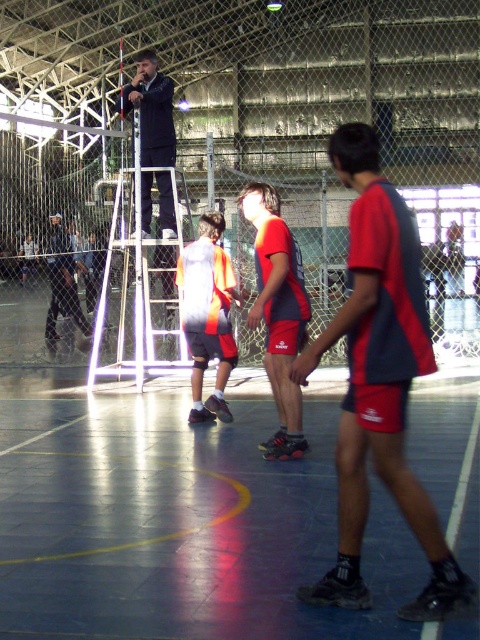
You are a referee standing at the edge of the basketball court. You need to determine if the distance between the orange mesh shorts at center and the dark blue jacket at upper center is more than 10 feet to ensure players are not too close during a free throw. Can you confirm this?

The orange mesh shorts at center is 12.33 feet away from the dark blue jacket at upper center, which is more than 10 feet. Therefore, the players are at a safe distance for a free throw.

You are standing at the origin point of the coordinate system in the basketball court. You want to throw a ball to the red fabric shorts at center. In which direction should you aim?

The red fabric shorts at center is located at point 0.600 on the x axis and 0.792 on the y axis. To reach it, aim towards the upper right direction since both coordinates are positive and greater than 0.5.